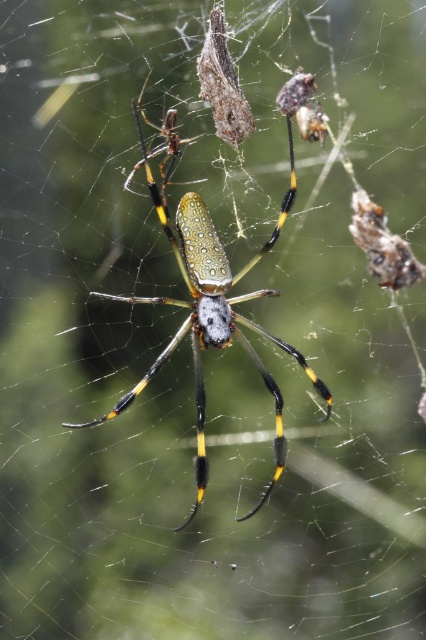
Can you confirm if shiny metallic spider at center is positioned to the left of translucent brown cocoon at upper center?

Indeed, shiny metallic spider at center is positioned on the left side of translucent brown cocoon at upper center.

Between point (293, 192) and point (210, 29), which one is positioned behind?

The point (293, 192) is more distant.

You are a GUI agent. You are given a task and a screenshot of the screen. Output one action in this format:
    pyautogui.click(x=<x>, y=<y>)
    Task: Click on the shiny metallic spider at center
    The width and height of the screenshot is (426, 640).
    Given the screenshot: What is the action you would take?
    pyautogui.click(x=209, y=300)